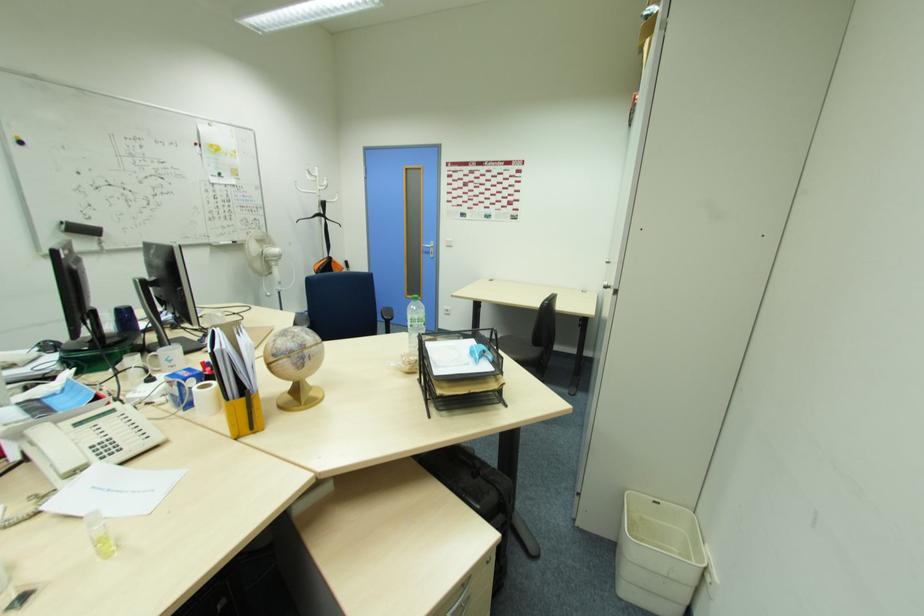
Where is `chair armrest`? Image resolution: width=924 pixels, height=616 pixels. chair armrest is located at coordinates (386, 317).